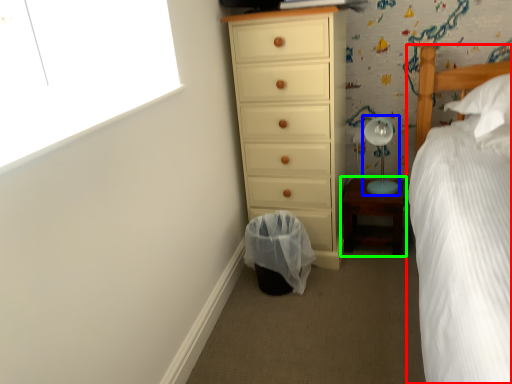
Question: Which object is the farthest from bed (highlighted by a red box)? Choose among these: table lamp (highlighted by a blue box) or nightstand (highlighted by a green box).

Choices:
 (A) table lamp
 (B) nightstand

Answer: (B)